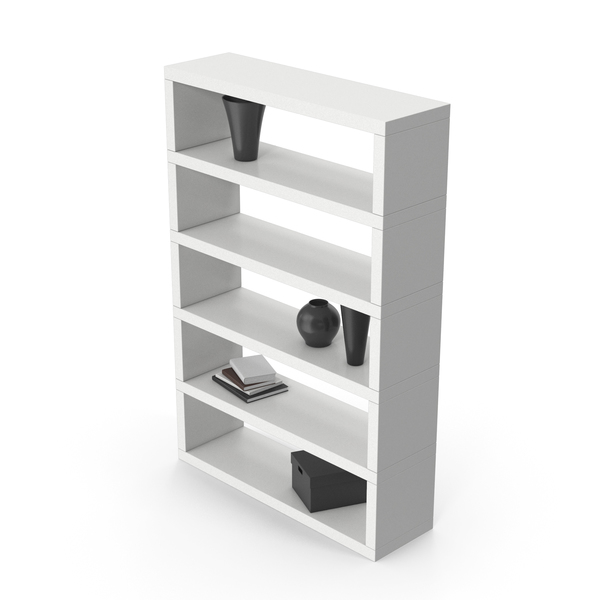
At what (x,y) coordinates should I click in order to perform the action: click on black vase. Please return your answer as a coordinate pair (x, y). This screenshot has width=600, height=600. Looking at the image, I should click on (241, 143).